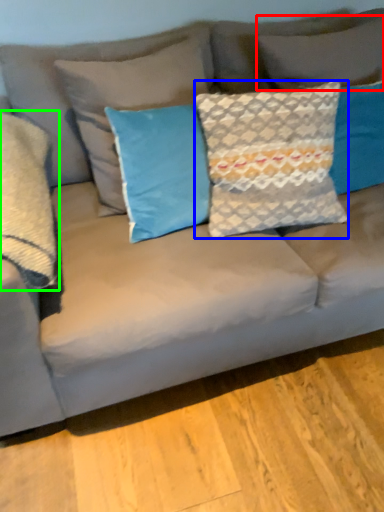
Question: Which object is the closest to the pillow (highlighted by a red box)? Choose among these: pillow (highlighted by a blue box) or pillow (highlighted by a green box).

Choices:
 (A) pillow
 (B) pillow

Answer: (A)